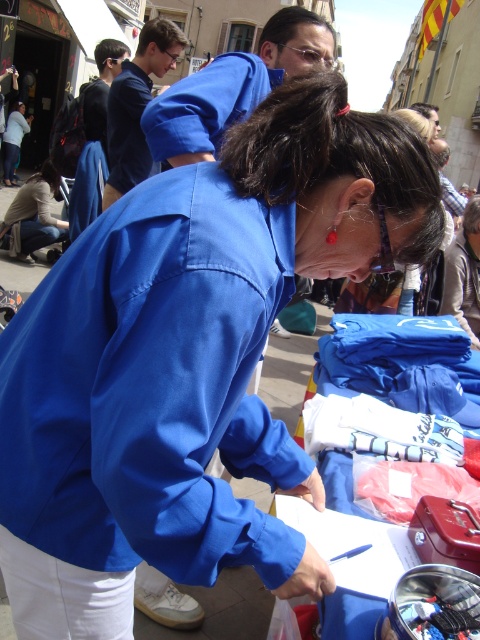
Question: Does blue fabric shirt at upper center have a larger size compared to light brown leather jacket at lower left?

Choices:
 (A) yes
 (B) no

Answer: (B)

Question: Which point is closer to the camera?

Choices:
 (A) blue fabric shirt at upper center
 (B) light brown leather jacket at lower left

Answer: (A)

Question: Which point appears closest to the camera in this image?

Choices:
 (A) (31, 230)
 (B) (273, 74)

Answer: (B)

Question: Which point is closer to the camera taking this photo?

Choices:
 (A) (32, 218)
 (B) (166, 104)

Answer: (B)

Question: Does blue fabric shirt at upper center come behind light brown leather jacket at lower left?

Choices:
 (A) yes
 (B) no

Answer: (B)

Question: Does blue fabric shirt at upper center come behind light brown leather jacket at lower left?

Choices:
 (A) no
 (B) yes

Answer: (A)